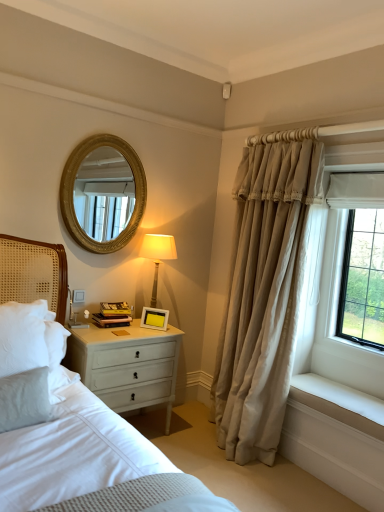
Question: Is hardcover books at bedside located outside matte beige lampshade at upper right?

Choices:
 (A) no
 (B) yes

Answer: (B)

Question: Is hardcover books at bedside with matte beige lampshade at upper right?

Choices:
 (A) no
 (B) yes

Answer: (A)

Question: From the image's perspective, is hardcover books at bedside on matte beige lampshade at upper right?

Choices:
 (A) yes
 (B) no

Answer: (B)

Question: Does hardcover books at bedside have a lesser width compared to matte beige lampshade at upper right?

Choices:
 (A) no
 (B) yes

Answer: (B)

Question: Are hardcover books at bedside and matte beige lampshade at upper right far apart?

Choices:
 (A) no
 (B) yes

Answer: (A)

Question: From the image's perspective, is hardcover books at bedside beneath matte beige lampshade at upper right?

Choices:
 (A) yes
 (B) no

Answer: (A)

Question: Does hardcover books at bedside appear on the left side of beige fabric curtain at right?

Choices:
 (A) yes
 (B) no

Answer: (A)

Question: Could beige fabric curtain at right be considered to be inside hardcover books at bedside?

Choices:
 (A) no
 (B) yes

Answer: (A)

Question: Is hardcover books at bedside smaller than beige fabric curtain at right?

Choices:
 (A) no
 (B) yes

Answer: (B)

Question: Is hardcover books at bedside located outside beige fabric curtain at right?

Choices:
 (A) no
 (B) yes

Answer: (B)

Question: From the image's perspective, is hardcover books at bedside beneath beige fabric curtain at right?

Choices:
 (A) yes
 (B) no

Answer: (A)

Question: Can you confirm if hardcover books at bedside is taller than beige fabric curtain at right?

Choices:
 (A) no
 (B) yes

Answer: (A)

Question: From the image's perspective, is white painted wood nightstand at lower left over gold textured mirror at upper center?

Choices:
 (A) yes
 (B) no

Answer: (B)